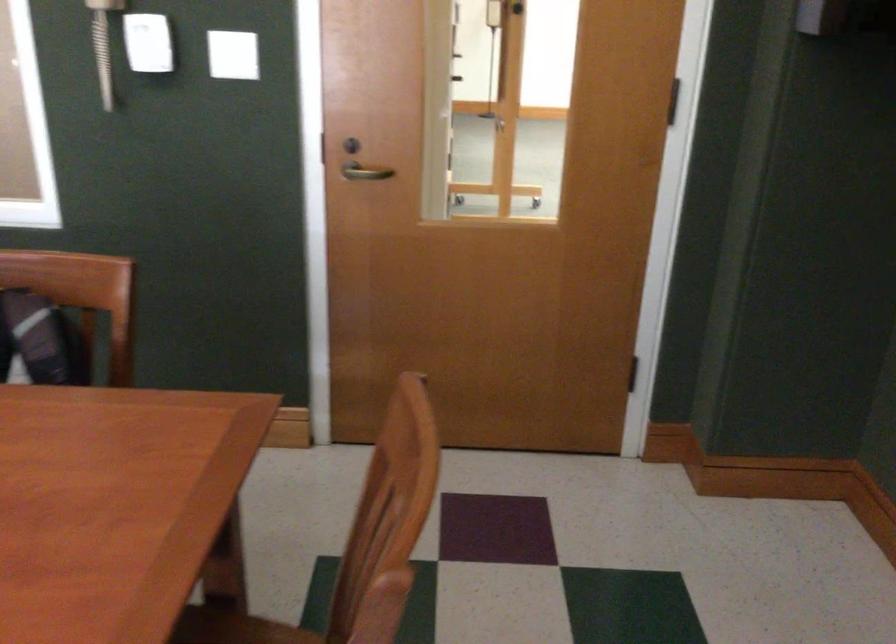
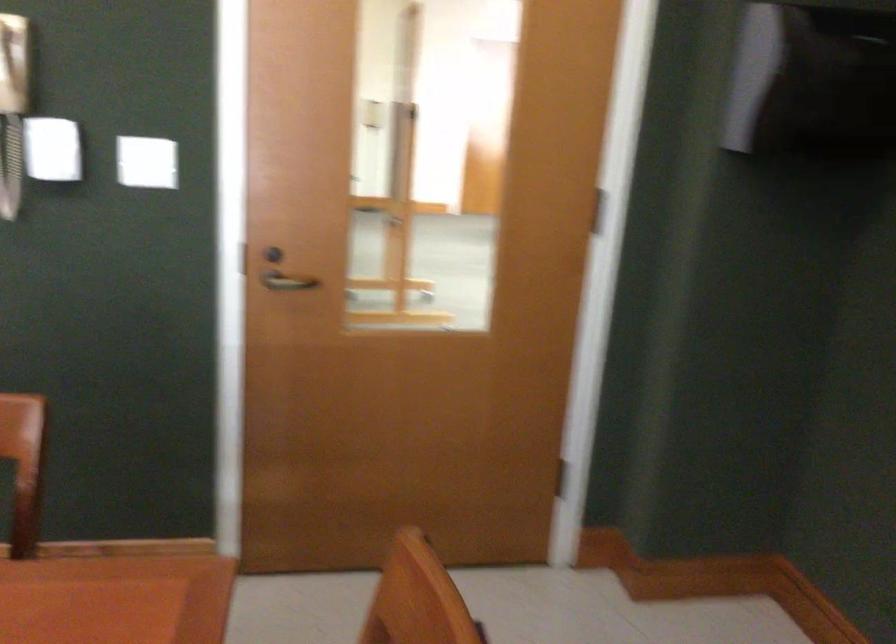
Question: How did the camera likely rotate?

Choices:
 (A) Left
 (B) Right
 (C) Up
 (D) Down

Answer: (B)